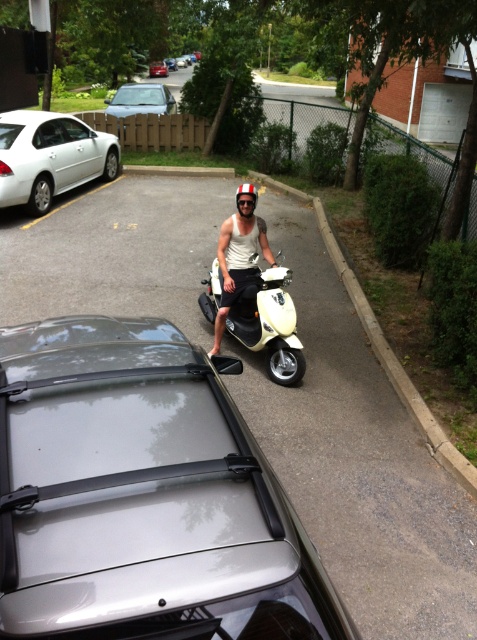
Looking at this image, can you confirm if silver metallic car at lower left is thinner than silver metallic sedan at upper left?

Yes.

Between point (188, 376) and point (114, 112), which one is positioned behind?

Positioned behind is point (114, 112).

You are a GUI agent. You are given a task and a screenshot of the screen. Output one action in this format:
    pyautogui.click(x=<x>, y=<y>)
    Task: Click on the silver metallic car at lower left
    The image size is (477, 640).
    Given the screenshot: What is the action you would take?
    pyautogui.click(x=143, y=496)

Consider the image. Is silver metallic sedan at upper left smaller than metallic silver sedan at center?

Incorrect, silver metallic sedan at upper left is not smaller in size than metallic silver sedan at center.

From the picture: Can you confirm if silver metallic sedan at upper left is wider than metallic silver sedan at center?

Indeed, silver metallic sedan at upper left has a greater width compared to metallic silver sedan at center.

Is point (147, 92) closer to camera compared to point (149, 74)?

Yes.

At what (x,y) coordinates should I click in order to perform the action: click on silver metallic sedan at upper left. Please return your answer as a coordinate pair (x, y). This screenshot has height=640, width=477. Looking at the image, I should click on (141, 99).

Does silver metallic sedan at upper left appear over shiny silver helmet at center?

Yes.

Does silver metallic sedan at upper left appear on the left side of shiny silver helmet at center?

Indeed, silver metallic sedan at upper left is positioned on the left side of shiny silver helmet at center.

Describe the element at coordinates (141, 99) in the screenshot. I see `silver metallic sedan at upper left` at that location.

At what (x,y) coordinates should I click in order to perform the action: click on silver metallic sedan at upper left. Please return your answer as a coordinate pair (x, y). The image size is (477, 640). Looking at the image, I should click on (141, 99).